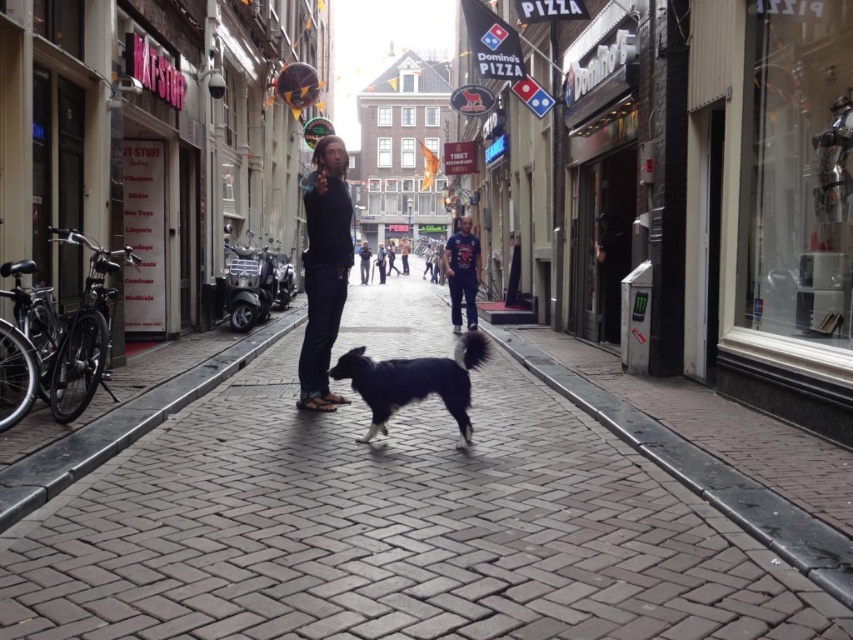
Between brick pavement at center and dark blue jeans at center, which one appears on the left side from the viewer's perspective?

dark blue jeans at center is more to the left.

Does brick pavement at center appear under dark blue jeans at center?

Yes, brick pavement at center is below dark blue jeans at center.

The image size is (853, 640). What do you see at coordinates (392, 531) in the screenshot? I see `brick pavement at center` at bounding box center [392, 531].

Where is `brick pavement at center`? The width and height of the screenshot is (853, 640). brick pavement at center is located at coordinates (392, 531).

Does dark blue jeans at center appear on the right side of blue denim jeans at center?

In fact, dark blue jeans at center is to the left of blue denim jeans at center.

Who is lower down, dark blue jeans at center or blue denim jeans at center?

dark blue jeans at center

You are a GUI agent. You are given a task and a screenshot of the screen. Output one action in this format:
    pyautogui.click(x=<x>, y=<y>)
    Task: Click on the dark blue jeans at center
    This screenshot has height=640, width=853.
    Given the screenshot: What is the action you would take?
    pyautogui.click(x=323, y=272)

Which is more to the right, brick pavement at center or blue denim jeans at center?

blue denim jeans at center

Who is more distant from viewer, (587,586) or (469,324)?

Point (469,324)

At what (x,y) coordinates should I click in order to perform the action: click on brick pavement at center. Please return your answer as a coordinate pair (x, y). Image resolution: width=853 pixels, height=640 pixels. Looking at the image, I should click on (392, 531).

Where is `brick pavement at center`? The width and height of the screenshot is (853, 640). brick pavement at center is located at coordinates tap(392, 531).